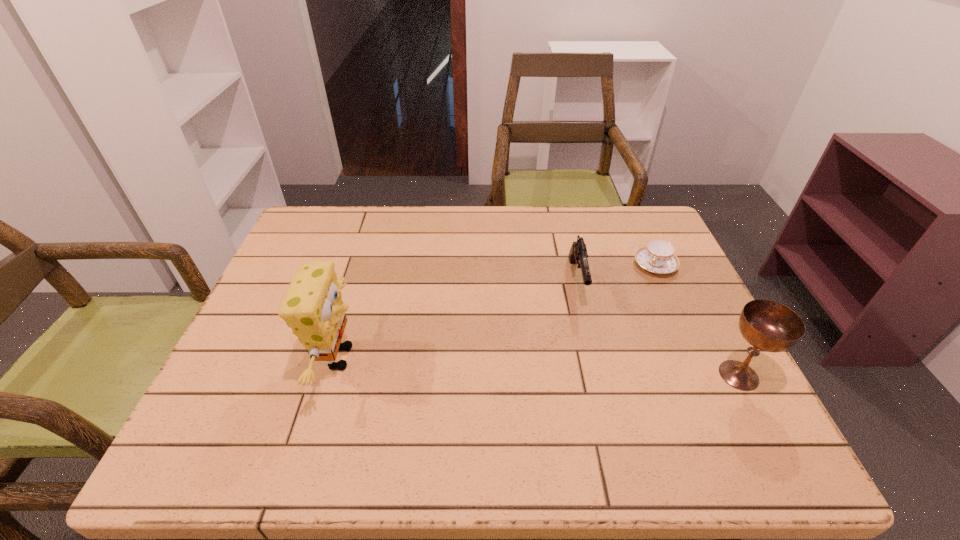
Locate an element on the screen. The height and width of the screenshot is (540, 960). vacant area between the shortest object and the chalice is located at coordinates (697, 320).

Locate an element on the screen. The width and height of the screenshot is (960, 540). vacant area that lies between the leftmost object and the second object from left to right is located at coordinates (458, 319).

The image size is (960, 540). Find the location of `free space between the teacup and the gun`. free space between the teacup and the gun is located at coordinates (616, 273).

Where is `vacant region between the shortest object and the third tallest object`? This screenshot has height=540, width=960. vacant region between the shortest object and the third tallest object is located at coordinates (616, 273).

The height and width of the screenshot is (540, 960). I want to click on free space between the second shortest object and the teacup, so click(x=616, y=273).

The width and height of the screenshot is (960, 540). I want to click on free spot between the gun and the chalice, so click(658, 328).

Find the location of a particular element. Image resolution: width=960 pixels, height=540 pixels. free spot between the second shortest object and the chalice is located at coordinates (658, 328).

Locate an element on the screen. The image size is (960, 540). the second closest object to the second shortest object is located at coordinates (767, 325).

What are the coordinates of `object that is the second closest one to the leftmost object` in the screenshot? It's located at (658, 256).

Find the location of a particular element. This screenshot has height=540, width=960. blank area in the image that satisfies the following two spatial constraints: 1. on the front side of the gun; 2. on the right side of the third shortest object is located at coordinates (600, 375).